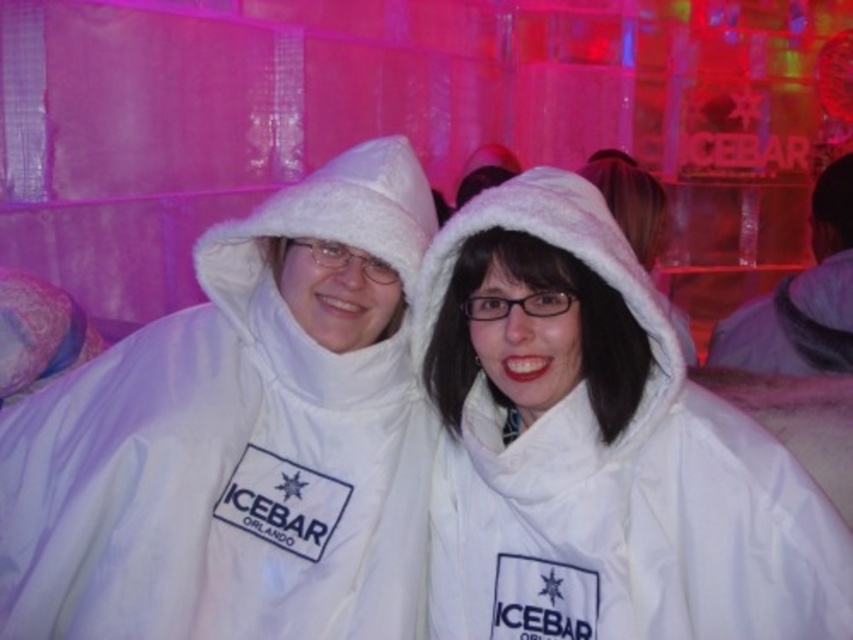
Is white fuzzy coat at center closer to the viewer compared to white fleece coat at center?

No, white fuzzy coat at center is further to the viewer.

Who is higher up, white fuzzy coat at center or white fleece coat at center?

Positioned higher is white fuzzy coat at center.

What do you see at coordinates (241, 436) in the screenshot? I see `white fuzzy coat at center` at bounding box center [241, 436].

In order to click on white fuzzy coat at center in this screenshot , I will do `click(241, 436)`.

Is white fuzzy coat at center behind white fleece robe at right?

No, it is in front of white fleece robe at right.

Is white fuzzy coat at center above white fleece robe at right?

Actually, white fuzzy coat at center is below white fleece robe at right.

Which is in front, point (341, 260) or point (820, 292)?

Point (341, 260) is in front.

The width and height of the screenshot is (853, 640). Identify the location of white fuzzy coat at center. (241, 436).

Is white fleece coat at center wider than white fleece robe at right?

Yes, white fleece coat at center is wider than white fleece robe at right.

Is point (627, 476) less distant than point (753, 300)?

Yes.

Between point (651, 310) and point (740, 323), which one is positioned behind?

Positioned behind is point (740, 323).

This screenshot has height=640, width=853. In order to click on white fleece coat at center in this screenshot , I will do `click(598, 448)`.